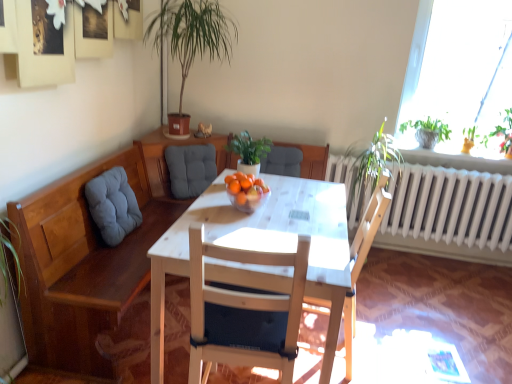
What do you see at coordinates (191, 41) in the screenshot? The height and width of the screenshot is (384, 512). I see `green leafy plant at upper center, which appears as the 2th houseplant when ordered from the bottom` at bounding box center [191, 41].

Find the location of a particular element. matte gray cushioned chair at center, the fourth chair when ordered from front to back is located at coordinates (300, 161).

In order to click on green matte plant at center, which is the second houseplant in top-to-bottom order in this screenshot , I will do `click(249, 152)`.

From the picture: Measure the distance between green matte plant at center, which ranks as the 1th houseplant in bottom-to-top order, and camera.

green matte plant at center, which ranks as the 1th houseplant in bottom-to-top order, is 6.76 feet from camera.

What do you see at coordinates (234, 187) in the screenshot? I see `orange matte at table center` at bounding box center [234, 187].

I want to click on gray fabric cushion at center, the 2th chair viewed from the back, so click(x=190, y=169).

Would you consider matte gray cushioned chair at center, the first chair viewed from the back, to be distant from green leafy plant at upper right?

matte gray cushioned chair at center, the first chair viewed from the back, is positioned a significant distance from green leafy plant at upper right.

Does matte gray cushioned chair at center, the fourth chair when ordered from front to back, have a lesser height compared to green leafy plant at upper right?

Indeed, matte gray cushioned chair at center, the fourth chair when ordered from front to back, has a lesser height compared to green leafy plant at upper right.

Can you confirm if matte gray cushioned chair at center, the first chair viewed from the back, is bigger than green leafy plant at upper right?

Actually, matte gray cushioned chair at center, the first chair viewed from the back, might be smaller than green leafy plant at upper right.

From a real-world perspective, is gray fabric cushion at center, which is counted as the third chair, starting from the front, physically below orange matte at table center?

Yes, from a real-world perspective, gray fabric cushion at center, which is counted as the third chair, starting from the front, is under orange matte at table center.

Which of these two, gray fabric cushion at center, which is counted as the third chair, starting from the front, or orange matte at table center, is bigger?

Bigger between the two is gray fabric cushion at center, which is counted as the third chair, starting from the front.

Which of these two, gray fabric cushion at center, the 2th chair viewed from the back, or orange matte at table center, stands shorter?

orange matte at table center.

Is gray fabric cushion at center, the 2th chair viewed from the back, directly adjacent to orange matte at table center?

There is a gap between gray fabric cushion at center, the 2th chair viewed from the back, and orange matte at table center.

Considering the relative sizes of white wood chair at center, which ranks as the 1th chair in front-to-back order, and matte gray cushioned chair at center, the first chair viewed from the back, in the image provided, is white wood chair at center, which ranks as the 1th chair in front-to-back order, taller than matte gray cushioned chair at center, the first chair viewed from the back,?

Yes.

Would you say white wood chair at center, positioned as the 4th chair in back-to-front order, is inside or outside matte gray cushioned chair at center, the first chair viewed from the back?

white wood chair at center, positioned as the 4th chair in back-to-front order, is not enclosed by matte gray cushioned chair at center, the first chair viewed from the back.

Looking at this image, from the image's perspective, is white wood chair at center, which ranks as the 1th chair in front-to-back order, under matte gray cushioned chair at center, the fourth chair when ordered from front to back?

Correct, white wood chair at center, which ranks as the 1th chair in front-to-back order, appears lower than matte gray cushioned chair at center, the fourth chair when ordered from front to back, in the image.

Who is smaller, white wood chair at center, positioned as the 4th chair in back-to-front order, or matte gray cushioned chair at center, the first chair viewed from the back?

matte gray cushioned chair at center, the first chair viewed from the back, is smaller.

Based on the photo, considering the positions of objects matte gray cushioned chair at center, the first chair viewed from the back, and white wood chair at center, which ranks as the 1th chair in front-to-back order, in the image provided, who is more to the right, matte gray cushioned chair at center, the first chair viewed from the back, or white wood chair at center, which ranks as the 1th chair in front-to-back order,?

From the viewer's perspective, matte gray cushioned chair at center, the first chair viewed from the back, appears more on the right side.

The width and height of the screenshot is (512, 384). Find the location of `the 3rd chair below the matte gray cushioned chair at center, the fourth chair when ordered from front to back (from the image's perspective)`. the 3rd chair below the matte gray cushioned chair at center, the fourth chair when ordered from front to back (from the image's perspective) is located at coordinates (244, 312).

Looking at this image, which is farther from the camera, (303, 166) or (251, 302)?

The point (303, 166) is farther from the camera.

Is matte gray cushioned chair at center, the first chair viewed from the back, far away from white wood chair at center, which ranks as the 1th chair in front-to-back order?

Indeed, matte gray cushioned chair at center, the first chair viewed from the back, is not near white wood chair at center, which ranks as the 1th chair in front-to-back order.

From the image's perspective, does green leafy plant at upper right appear lower than orange matte at table center?

No, from the image's perspective, green leafy plant at upper right is not beneath orange matte at table center.

Are green leafy plant at upper right and orange matte at table center beside each other?

green leafy plant at upper right and orange matte at table center are not in contact.

Considering the positions of objects green leafy plant at upper right and orange matte at table center in the image provided, who is behind, green leafy plant at upper right or orange matte at table center?

green leafy plant at upper right is further away from the camera.

Which of these two, green leafy plant at upper right or orange matte at table center, is wider?

green leafy plant at upper right.

The image size is (512, 384). I want to click on chair that is the 3rd object to the right of the gray fabric cushion at center, which is counted as the third chair, starting from the front, starting at the anchor, so click(362, 259).

Choose the correct answer: Is gray fabric cushion at center, the 2th chair viewed from the back, inside wooden chair at center, the third chair positioned from the back, or outside it?

The correct answer is: outside.

From a real-world perspective, is gray fabric cushion at center, the 2th chair viewed from the back, physically located above or below wooden chair at center, which is the 2th chair in front-to-back order?

Clearly, from a real-world perspective, gray fabric cushion at center, the 2th chair viewed from the back, is above wooden chair at center, which is the 2th chair in front-to-back order.

Looking at this image, does gray fabric cushion at center, the 2th chair viewed from the back, have a greater width compared to wooden chair at center, the third chair positioned from the back?

Incorrect, the width of gray fabric cushion at center, the 2th chair viewed from the back, does not surpass that of wooden chair at center, the third chair positioned from the back.

From the image's perspective, would you say green leafy plant at upper center, which appears as the 2th houseplant when ordered from the bottom, is shown under green matte plant at center, which is the second houseplant in top-to-bottom order?

No.

Is green leafy plant at upper center, acting as the 1th houseplant starting from the top, oriented towards green matte plant at center, which ranks as the 1th houseplant in bottom-to-top order?

No, green leafy plant at upper center, acting as the 1th houseplant starting from the top, is not turned towards green matte plant at center, which ranks as the 1th houseplant in bottom-to-top order.

From a real-world perspective, is green leafy plant at upper center, which appears as the 2th houseplant when ordered from the bottom, located higher than green matte plant at center, which ranks as the 1th houseplant in bottom-to-top order?

Yes, from a real-world perspective, green leafy plant at upper center, which appears as the 2th houseplant when ordered from the bottom, is over green matte plant at center, which ranks as the 1th houseplant in bottom-to-top order

Image resolution: width=512 pixels, height=384 pixels. In order to click on plant that is above the matte gray cushioned chair at center, the first chair viewed from the back (from the image's perspective) in this screenshot , I will do `click(502, 133)`.

Find the location of a particular element. Image resolution: width=512 pixels, height=384 pixels. the 1st chair behind the orange matte at table center, starting your count from the anchor is located at coordinates (190, 169).

Which object lies nearer to the anchor point gray fabric cushion at left, gray fabric cushion at center, the 2th chair viewed from the back, or white wood chair at center, which ranks as the 1th chair in front-to-back order?

gray fabric cushion at center, the 2th chair viewed from the back, lies closer to gray fabric cushion at left than the other object.

Considering their positions, is green leafy plant at upper right positioned further to gray fabric cushion at left than matte gray cushioned chair at center, the first chair viewed from the back?

green leafy plant at upper right lies further to gray fabric cushion at left than the other object.

When comparing their distances from matte gray cushioned chair at center, the fourth chair when ordered from front to back, does gray fabric cushion at center, the 2th chair viewed from the back, or gray fabric cushion at left seem closer?

gray fabric cushion at center, the 2th chair viewed from the back, is closer to matte gray cushioned chair at center, the fourth chair when ordered from front to back.

Considering their positions, is gray fabric cushion at center, the 2th chair viewed from the back, positioned further to green leafy plant at upper center, acting as the 1th houseplant starting from the top, than orange matte at table center?

The object further to green leafy plant at upper center, acting as the 1th houseplant starting from the top, is orange matte at table center.

When comparing their distances from white wood chair at center, positioned as the 4th chair in back-to-front order, does wooden chair at center, which is the 2th chair in front-to-back order, or matte gray cushioned chair at center, the fourth chair when ordered from front to back, seem closer?

Answer: wooden chair at center, which is the 2th chair in front-to-back order.

Estimate the real-world distances between objects in this image. Which object is closer to white wood chair at center, positioned as the 4th chair in back-to-front order, wooden chair at center, which is the 2th chair in front-to-back order, or gray fabric cushion at left?

wooden chair at center, which is the 2th chair in front-to-back order.

Looking at the image, which one is located closer to green matte plant at center, which is the second houseplant in top-to-bottom order, gray fabric cushion at center, the 2th chair viewed from the back, or wooden chair at center, which is the 2th chair in front-to-back order?

Based on the image, gray fabric cushion at center, the 2th chair viewed from the back, appears to be nearer to green matte plant at center, which is the second houseplant in top-to-bottom order.

When comparing their distances from white wood chair at center, which ranks as the 1th chair in front-to-back order, does gray fabric cushion at left or green leafy plant at upper right seem closer?

Based on the image, gray fabric cushion at left appears to be nearer to white wood chair at center, which ranks as the 1th chair in front-to-back order.

You are a GUI agent. You are given a task and a screenshot of the screen. Output one action in this format:
    pyautogui.click(x=<x>, y=<y>)
    Task: Click on the bowl between green leafy plant at upper center, which appears as the 2th houseplant when ordered from the bottom, and green leafy plant at upper right, in the horizontal direction
    The height and width of the screenshot is (384, 512).
    Given the screenshot: What is the action you would take?
    pyautogui.click(x=247, y=198)

The width and height of the screenshot is (512, 384). In order to click on swivel chair between translucent glass bowl at center and gray fabric cushion at center, which is counted as the third chair, starting from the front, along the z-axis in this screenshot , I will do `click(113, 205)`.

The image size is (512, 384). Find the location of `swivel chair between white wood chair at center, positioned as the 4th chair in back-to-front order, and gray fabric cushion at center, the 2th chair viewed from the back, along the z-axis`. swivel chair between white wood chair at center, positioned as the 4th chair in back-to-front order, and gray fabric cushion at center, the 2th chair viewed from the back, along the z-axis is located at coordinates (113, 205).

Where is `bowl located between orange matte at table center and green leafy plant at upper right in the left-right direction`? This screenshot has width=512, height=384. bowl located between orange matte at table center and green leafy plant at upper right in the left-right direction is located at coordinates (247, 198).